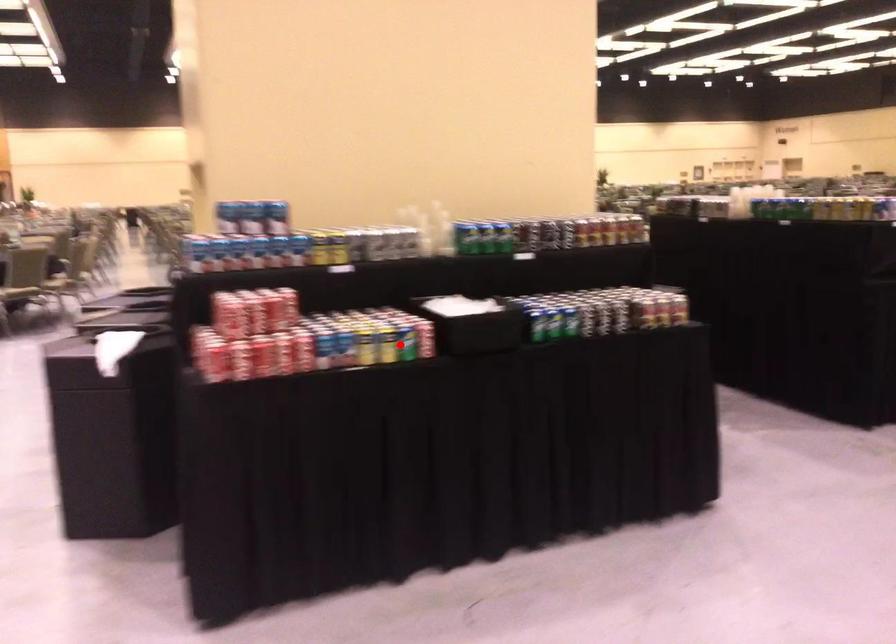
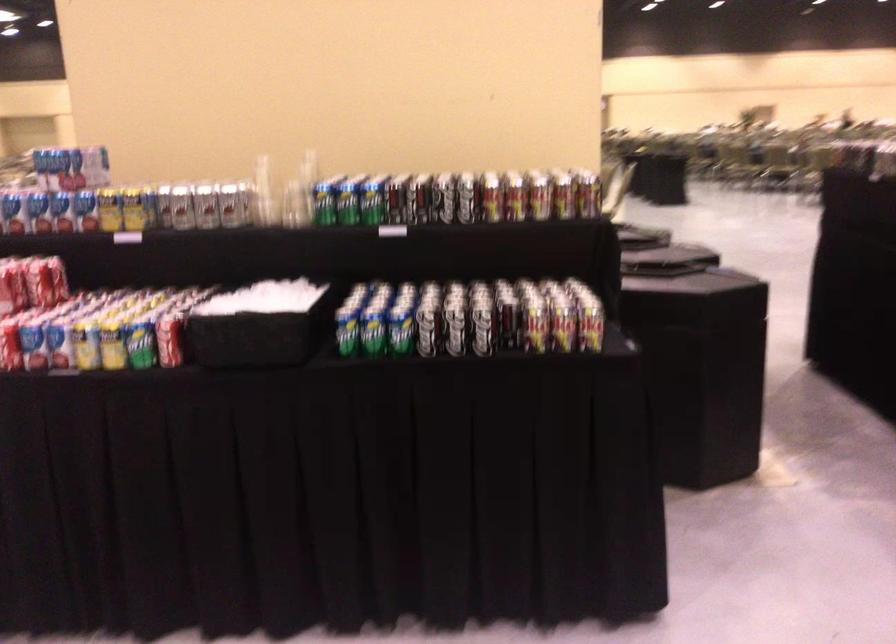
Question: I am providing you with two images of the same scene from different viewpoints. In image1, a red point is highlighted. Considering the same 3D point in image2, which of the following is correct?

Choices:
 (A) It is closer
 (B) It is farther

Answer: (A)